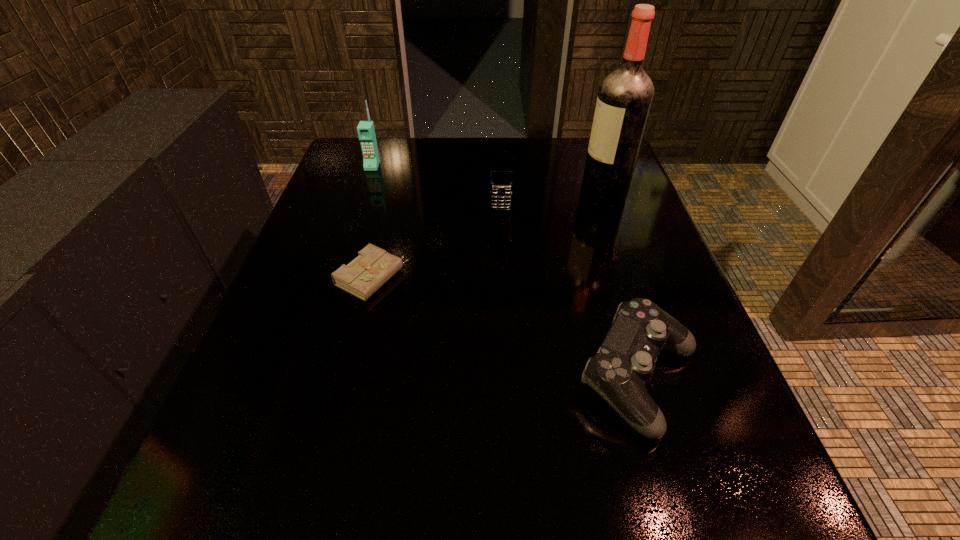
Locate an element on the screen. This screenshot has width=960, height=540. liquor is located at coordinates (624, 99).

Image resolution: width=960 pixels, height=540 pixels. I want to click on the farthest object, so click(x=366, y=132).

Locate an element on the screen. The height and width of the screenshot is (540, 960). the second tallest object is located at coordinates (366, 132).

The width and height of the screenshot is (960, 540). Identify the location of the third object from left to right. (501, 171).

In order to click on the nearer cellular telephone in this screenshot , I will do `click(501, 171)`.

The image size is (960, 540). In order to click on control in this screenshot , I will do `click(624, 363)`.

Image resolution: width=960 pixels, height=540 pixels. I want to click on the nearest object, so click(x=624, y=363).

You are a GUI agent. You are given a task and a screenshot of the screen. Output one action in this format:
    pyautogui.click(x=<x>, y=<y>)
    Task: Click on the shortest object
    
    Given the screenshot: What is the action you would take?
    pyautogui.click(x=362, y=277)

Find the location of `the second nearest object`. the second nearest object is located at coordinates (362, 277).

The width and height of the screenshot is (960, 540). What are the coordinates of `vacant space located 0.180m on the front-facing side of the tallest object` in the screenshot? It's located at click(503, 196).